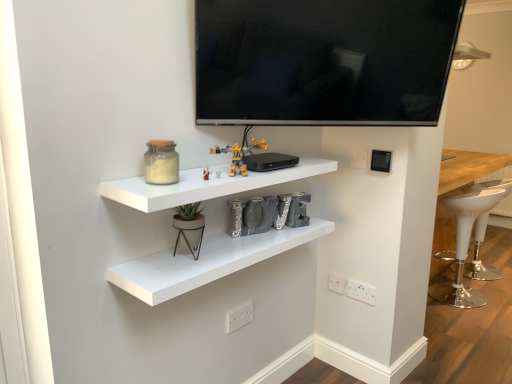
The height and width of the screenshot is (384, 512). In order to click on free space behind matte white pot at center, the first toy viewed from the left in this screenshot , I will do `click(215, 237)`.